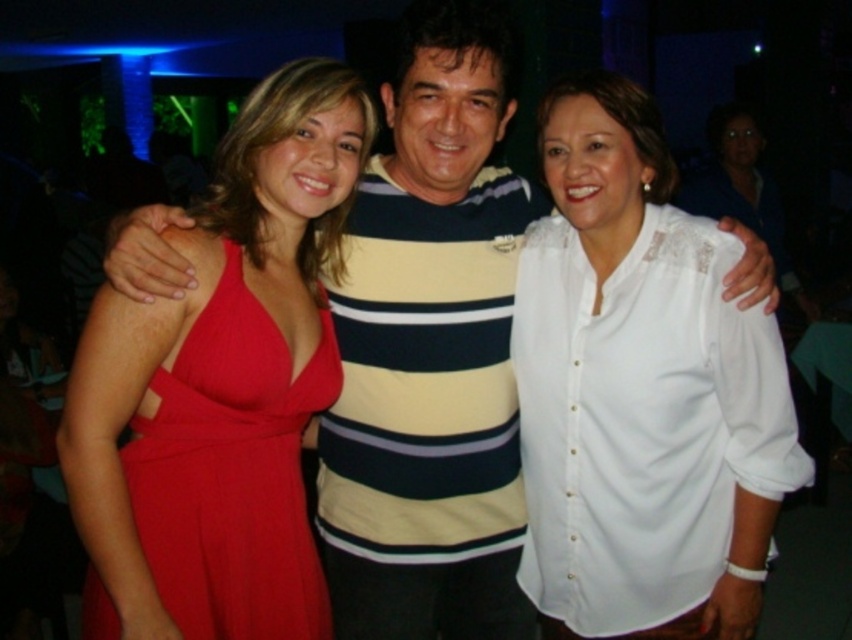
Question: Does white button-down shirt at center have a smaller size compared to matte red dress at left?

Choices:
 (A) no
 (B) yes

Answer: (A)

Question: Can you confirm if white button-down shirt at center is positioned to the left of matte red dress at left?

Choices:
 (A) no
 (B) yes

Answer: (A)

Question: Which of the following is the closest to the observer?

Choices:
 (A) white button-down shirt at center
 (B) matte red dress at left

Answer: (B)

Question: Is white button-down shirt at center thinner than matte red dress at left?

Choices:
 (A) no
 (B) yes

Answer: (A)

Question: Among these points, which one is nearest to the camera?

Choices:
 (A) click(x=208, y=460)
 (B) click(x=772, y=356)

Answer: (A)